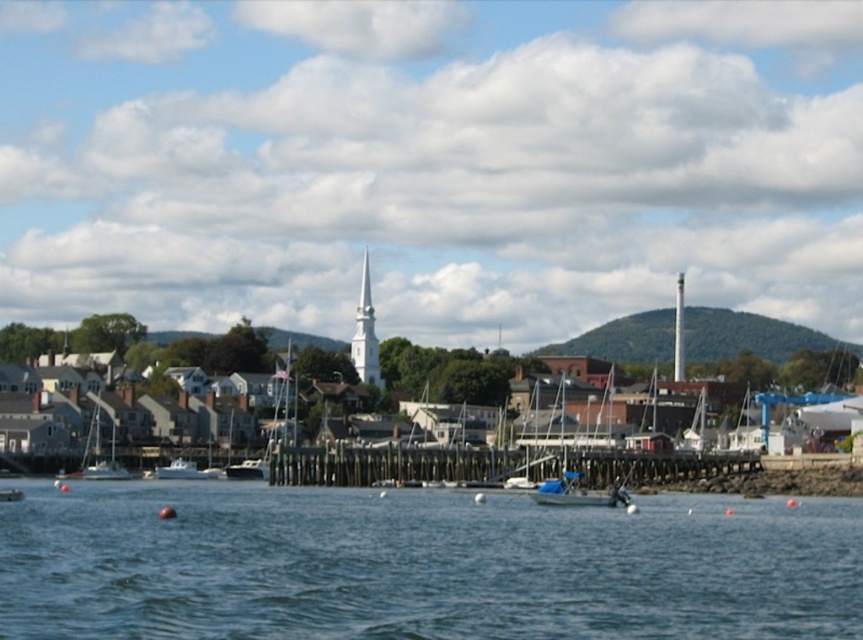
Does white matte boat at center have a lesser width compared to white matte boat at lower left?

Correct, white matte boat at center's width is less than white matte boat at lower left's.

Is white matte boat at center shorter than white matte boat at lower left?

Yes.

Who is more forward, (234, 472) or (10, 493)?

Point (10, 493) is more forward.

In order to click on white matte boat at center in this screenshot , I will do `click(249, 468)`.

Based on the photo, is white smooth spire at center positioned behind blue fabric boat at center?

Yes, it is.

Which is in front, point (363, 364) or point (618, 492)?

Point (618, 492) is in front.

The image size is (863, 640). Find the location of `white smooth spire at center`. white smooth spire at center is located at coordinates (364, 333).

Is blue water at lower center bigger than white matte boat at center?

Correct, blue water at lower center is larger in size than white matte boat at center.

Does point (287, 557) come in front of point (262, 480)?

That is True.

You are a GUI agent. You are given a task and a screenshot of the screen. Output one action in this format:
    pyautogui.click(x=<x>, y=<y>)
    Task: Click on the blue water at lower center
    Image resolution: width=863 pixels, height=640 pixels.
    Given the screenshot: What is the action you would take?
    pyautogui.click(x=420, y=564)